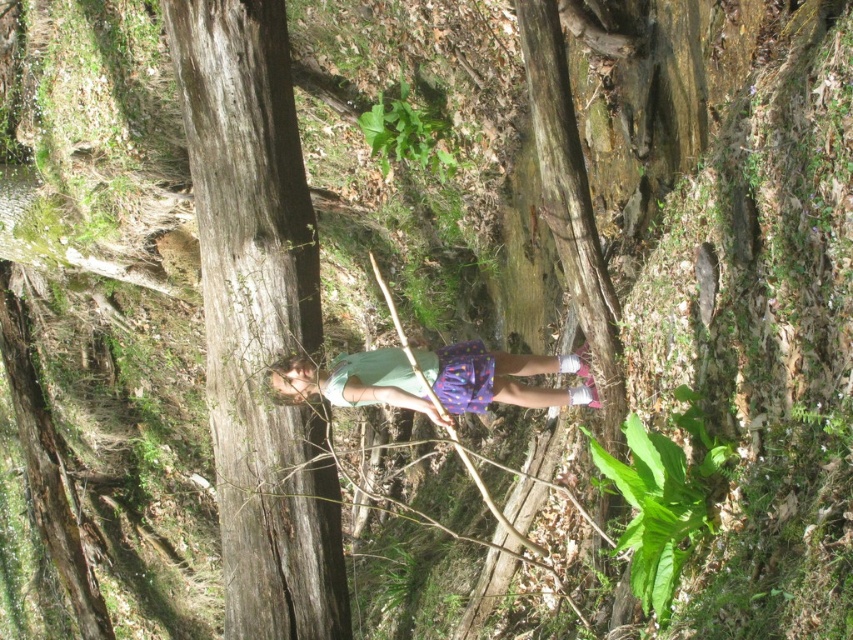
Question: Which point is farther to the camera?

Choices:
 (A) (544, 358)
 (B) (233, 620)

Answer: (A)

Question: Which object appears farthest from the camera in this image?

Choices:
 (A) multicolored fabric shorts at center
 (B) smooth brown tree trunk at left

Answer: (B)

Question: Which object is farther from the camera taking this photo?

Choices:
 (A) multicolored fabric shorts at center
 (B) smooth brown tree trunk at left

Answer: (B)

Question: Can you confirm if smooth brown tree trunk at left is positioned to the right of multicolored fabric shorts at center?

Choices:
 (A) no
 (B) yes

Answer: (A)

Question: Can you confirm if smooth brown tree trunk at left is thinner than multicolored fabric shorts at center?

Choices:
 (A) yes
 (B) no

Answer: (A)

Question: Where is smooth brown tree trunk at left located in relation to multicolored fabric shorts at center in the image?

Choices:
 (A) right
 (B) left

Answer: (B)